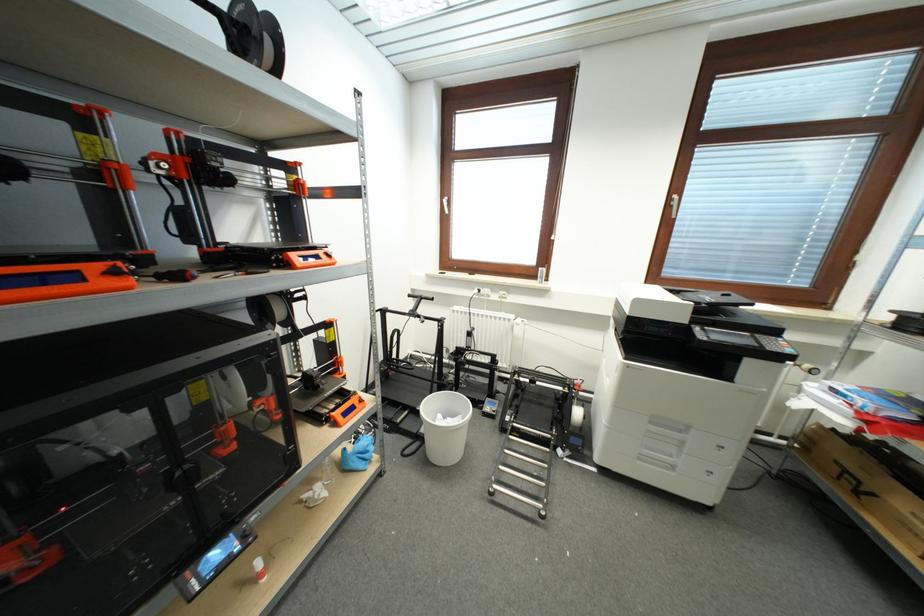
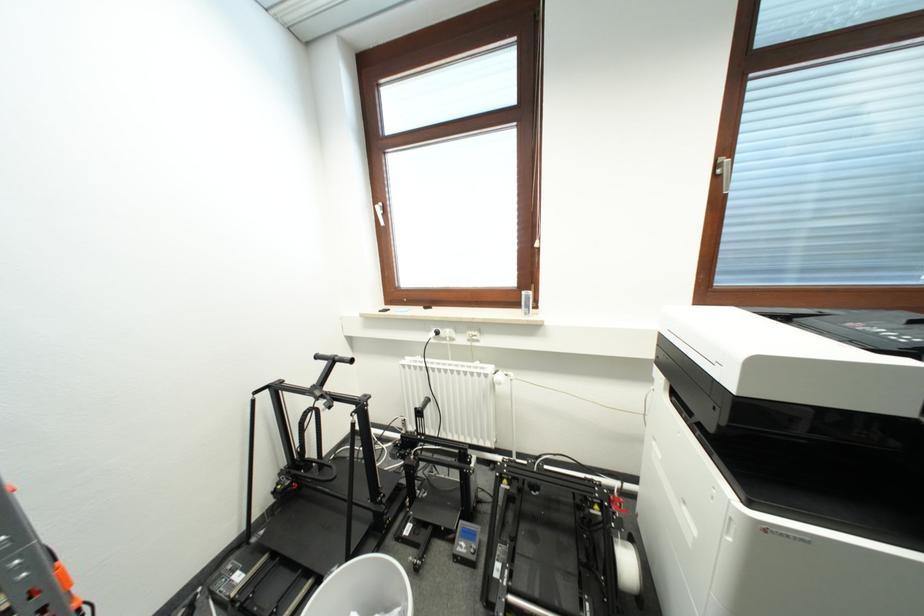
The images are taken continuously from a first-person perspective. In which direction are you moving?

The movement direction of the cameraman is right, forward.